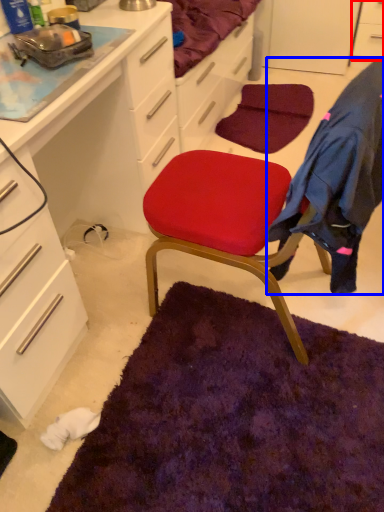
Question: Among these objects, which one is nearest to the camera, cabinetry (highlighted by a red box) or clothing (highlighted by a blue box)?

Choices:
 (A) cabinetry
 (B) clothing

Answer: (B)